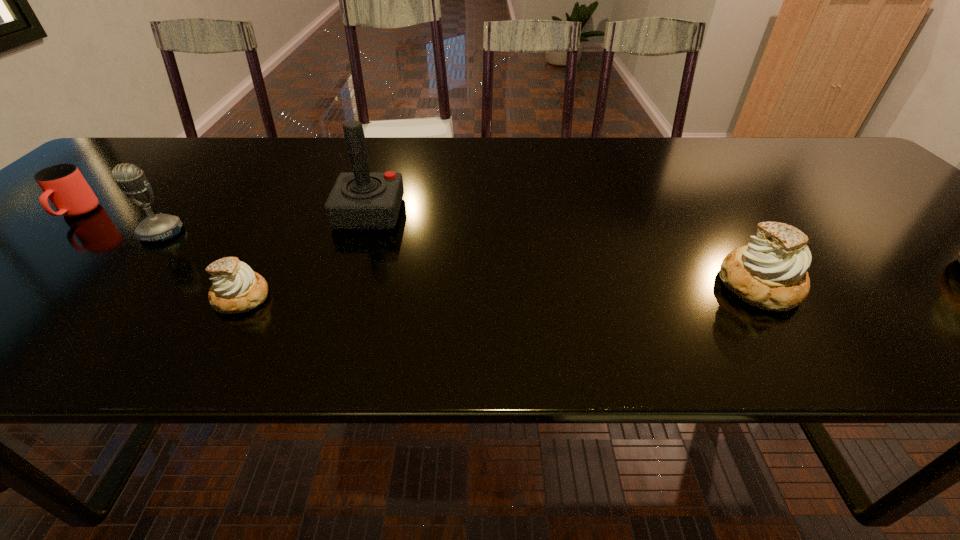
Identify the location of free space that is in between the cup and the third shortest object. Image resolution: width=960 pixels, height=540 pixels. (419, 249).

Image resolution: width=960 pixels, height=540 pixels. In order to click on free space that is in between the second object from right to left and the second tallest object in this screenshot , I will do (x=266, y=223).

Locate an element on the screen. This screenshot has width=960, height=540. vacant area that lies between the right pastry and the fourth shortest object is located at coordinates (461, 259).

At what (x,y) coordinates should I click in order to perform the action: click on empty location between the microphone and the leftmost object. Please return your answer as a coordinate pair (x, y). Image resolution: width=960 pixels, height=540 pixels. Looking at the image, I should click on (119, 224).

The height and width of the screenshot is (540, 960). What are the coordinates of `free space between the tallest object and the taller pastry` in the screenshot? It's located at (564, 249).

Identify the location of empty space that is in between the cup and the shorter pastry. Image resolution: width=960 pixels, height=540 pixels. (159, 255).

You are a GUI agent. You are given a task and a screenshot of the screen. Output one action in this format:
    pyautogui.click(x=<x>, y=<y>)
    Task: Click on the empty space that is in between the tallest object and the shorter pastry
    This screenshot has width=960, height=540.
    Given the screenshot: What is the action you would take?
    pyautogui.click(x=305, y=255)

Where is `vacant area that lies between the fourth shortest object and the cup`? This screenshot has width=960, height=540. vacant area that lies between the fourth shortest object and the cup is located at coordinates (119, 224).

Identify the location of object that is the third nearest to the cup. (360, 200).

Locate which object ranks in proximity to the fourth shortest object. Please provide its 2D coordinates. Your answer should be formatted as a tuple, i.e. [(x, y)], where the tuple contains the x and y coordinates of a point satisfying the conditions above.

[(63, 184)]